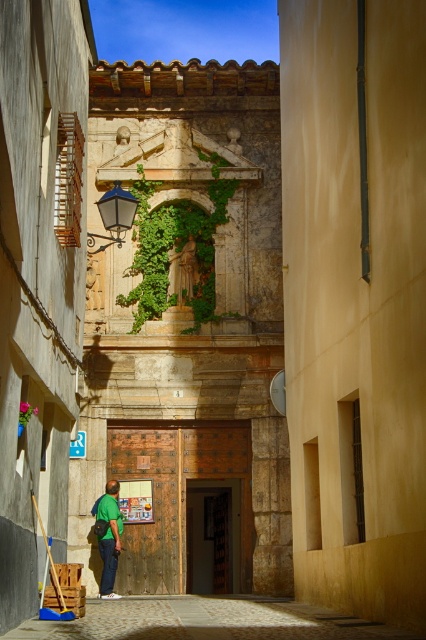
Question: Which of these objects is positioned closest to the green leafy ivy at center?

Choices:
 (A) green fabric shirt at lower left
 (B) cobblestone pavement at center

Answer: (A)

Question: Can you confirm if green leafy ivy at center is positioned to the left of green fabric shirt at lower left?

Choices:
 (A) yes
 (B) no

Answer: (B)

Question: Which point is closer to the camera?

Choices:
 (A) (135, 273)
 (B) (101, 561)

Answer: (B)

Question: Is green leafy ivy at center wider than green fabric shirt at lower left?

Choices:
 (A) yes
 (B) no

Answer: (A)

Question: Is green leafy ivy at center in front of green fabric shirt at lower left?

Choices:
 (A) yes
 (B) no

Answer: (B)

Question: Which object is the closest to the cobblestone pavement at center?

Choices:
 (A) green fabric shirt at lower left
 (B) green leafy ivy at center

Answer: (A)